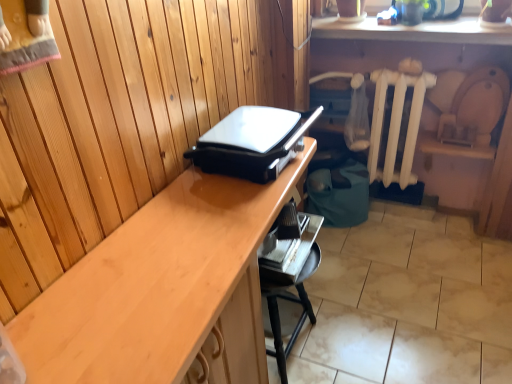
Question: Considering the relative sizes of metallic silver tray at lower center and black plastic grill at center in the image provided, is metallic silver tray at lower center wider than black plastic grill at center?

Choices:
 (A) yes
 (B) no

Answer: (B)

Question: Is metallic silver tray at lower center facing away from black plastic grill at center?

Choices:
 (A) yes
 (B) no

Answer: (B)

Question: Is metallic silver tray at lower center in contact with black plastic grill at center?

Choices:
 (A) yes
 (B) no

Answer: (B)

Question: Is metallic silver tray at lower center further to camera compared to black plastic grill at center?

Choices:
 (A) yes
 (B) no

Answer: (A)

Question: From the image's perspective, is metallic silver tray at lower center located beneath black plastic grill at center?

Choices:
 (A) yes
 (B) no

Answer: (A)

Question: In terms of width, does wooden desk at center look wider or thinner when compared to metallic silver tray at lower center?

Choices:
 (A) wide
 (B) thin

Answer: (A)

Question: From a real-world perspective, is wooden desk at center positioned above or below metallic silver tray at lower center?

Choices:
 (A) below
 (B) above

Answer: (B)

Question: From their relative heights in the image, would you say wooden desk at center is taller or shorter than metallic silver tray at lower center?

Choices:
 (A) tall
 (B) short

Answer: (A)

Question: In the image, is wooden desk at center on the left side or the right side of metallic silver tray at lower center?

Choices:
 (A) right
 (B) left

Answer: (B)

Question: In terms of width, does metallic silver tray at lower center look wider or thinner when compared to black plastic grill at center?

Choices:
 (A) wide
 (B) thin

Answer: (B)

Question: In the image, is metallic silver tray at lower center positioned in front of or behind black plastic grill at center?

Choices:
 (A) front
 (B) behind

Answer: (B)

Question: From a real-world perspective, is metallic silver tray at lower center above or below black plastic grill at center?

Choices:
 (A) above
 (B) below

Answer: (B)

Question: Visually, is metallic silver tray at lower center positioned to the left or to the right of black plastic grill at center?

Choices:
 (A) left
 (B) right

Answer: (B)

Question: Is white painted wood radiator at center right wider or thinner than black plastic grill at center?

Choices:
 (A) thin
 (B) wide

Answer: (A)

Question: From the image's perspective, is white painted wood radiator at center right located above or below black plastic grill at center?

Choices:
 (A) above
 (B) below

Answer: (A)